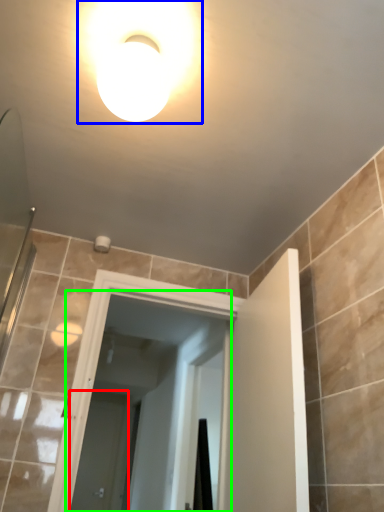
Question: Estimate the real-world distances between objects in this image. Which object is closer to screen door (highlighted by a red box), light fixture (highlighted by a blue box) or screen door (highlighted by a green box)?

Choices:
 (A) light fixture
 (B) screen door

Answer: (B)